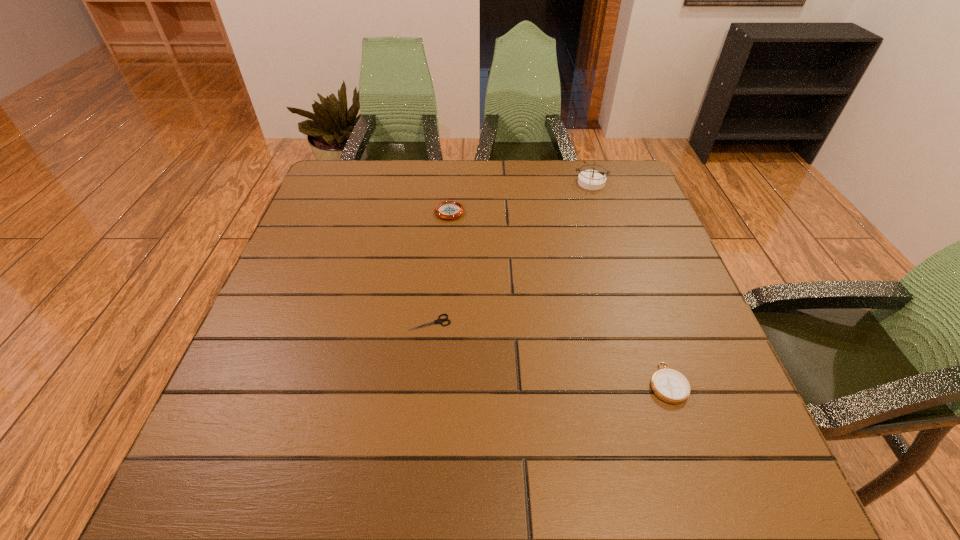
Identify the location of the closest compass relative to the nearest object. (448, 209).

The image size is (960, 540). What are the coordinates of `free space in the image that satisfies the following two spatial constraints: 1. on the back side of the shortest object; 2. on the right side of the third nearest object` in the screenshot? It's located at (442, 211).